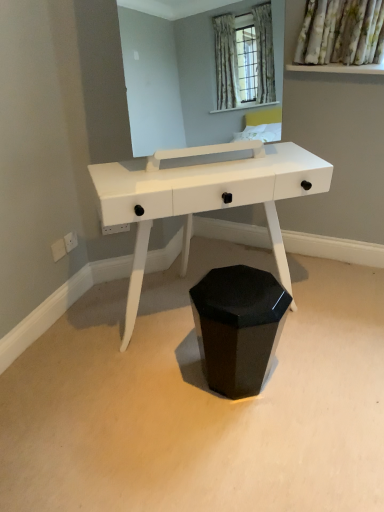
Locate an element on the screen. This screenshot has width=384, height=512. vacant point to the right of white glossy table at center is located at coordinates (332, 329).